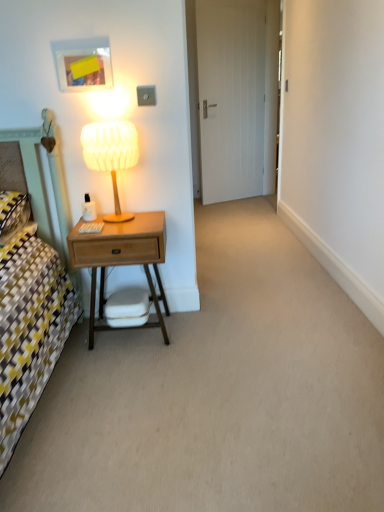
I want to click on free region under wooden table lamp at left (from a real-world perspective), so click(x=129, y=216).